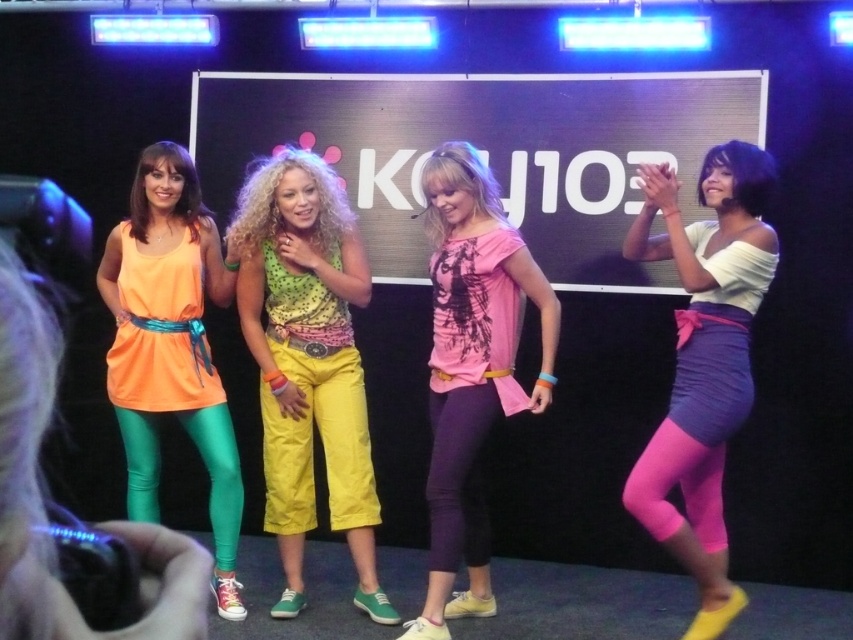
Does polka dot fabric top at center have a greater width compared to matte white top at right?

Correct, the width of polka dot fabric top at center exceeds that of matte white top at right.

Does polka dot fabric top at center have a lesser height compared to matte white top at right?

In fact, polka dot fabric top at center may be taller than matte white top at right.

Image resolution: width=853 pixels, height=640 pixels. Describe the element at coordinates (308, 362) in the screenshot. I see `polka dot fabric top at center` at that location.

Find the location of a particular element. polka dot fabric top at center is located at coordinates (308, 362).

From the picture: Measure the distance between pink matte t-shirt at center and matte orange dress at left.

pink matte t-shirt at center is 3.88 feet away from matte orange dress at left.

Does pink matte t-shirt at center appear over matte orange dress at left?

No, pink matte t-shirt at center is not above matte orange dress at left.

Is point (531, 285) less distant than point (141, 362)?

Yes, point (531, 285) is closer to viewer.

Where is `pink matte t-shirt at center`? The width and height of the screenshot is (853, 640). pink matte t-shirt at center is located at coordinates (471, 369).

Based on the photo, does matte white top at right appear over pink matte t-shirt at center?

Yes, matte white top at right is above pink matte t-shirt at center.

Describe the element at coordinates (704, 362) in the screenshot. I see `matte white top at right` at that location.

Describe the element at coordinates (704, 362) in the screenshot. I see `matte white top at right` at that location.

The height and width of the screenshot is (640, 853). Identify the location of matte white top at right. (704, 362).